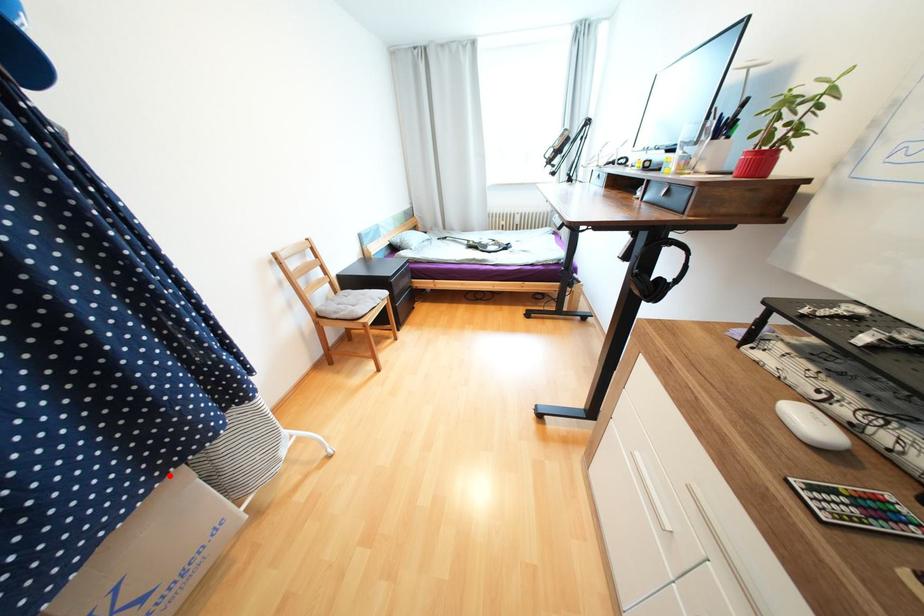
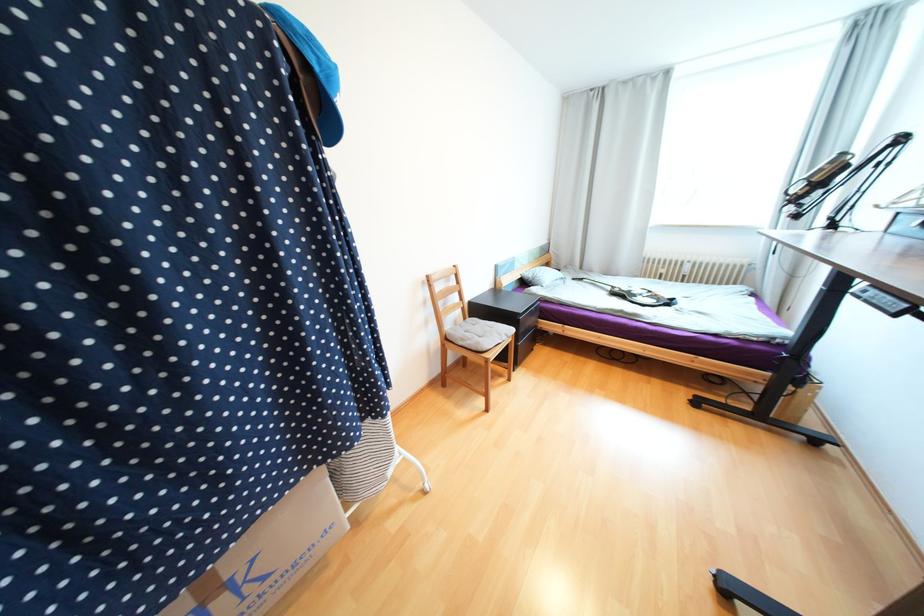
Locate, in the second image, the point that corresponds to the highlighted location in the first image.

(314, 471)